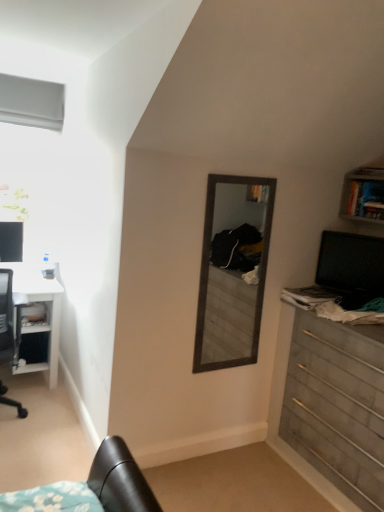
How much space does black glossy computer monitor at right, which is the second computer monitor from back to front, occupy horizontally?

The width of black glossy computer monitor at right, which is the second computer monitor from back to front, is 2.14 inches.

This screenshot has height=512, width=384. Describe the element at coordinates (337, 407) in the screenshot. I see `wooden chest of drawers at right` at that location.

What do you see at coordinates (11, 241) in the screenshot? I see `matte black monitor at left, the second computer monitor viewed from the front` at bounding box center [11, 241].

Image resolution: width=384 pixels, height=512 pixels. What do you see at coordinates (31, 102) in the screenshot?
I see `white matte window at upper left` at bounding box center [31, 102].

You are a GUI agent. You are given a task and a screenshot of the screen. Output one action in this format:
    pyautogui.click(x=<x>, y=<y>)
    Task: Click on the brushed metal shelf at lower left
    Image resolution: width=384 pixels, height=512 pixels.
    Given the screenshot: What is the action you would take?
    point(35,317)

Find the location of a particular element. black glossy computer monitor at right, the first computer monitor viewed from the front is located at coordinates (351, 267).

From a real-world perspective, is wooden chest of drawers at right below white glossy desk at left?

No, from a real-world perspective, wooden chest of drawers at right is not below white glossy desk at left.

In the scene shown: Is wooden chest of drawers at right oriented towards white glossy desk at left?

No, wooden chest of drawers at right is not turned towards white glossy desk at left.

Looking at this image, can you tell me how much wooden chest of drawers at right and white glossy desk at left differ in facing direction?

90.1 degrees.

Would you say wooden chest of drawers at right is outside white glossy desk at left?

wooden chest of drawers at right is positioned outside white glossy desk at left.

How different are the orientations of black glossy computer monitor at right, positioned as the 1th computer monitor in right-to-left order, and brushed metal shelf at lower left in degrees?

They differ by 56.6 degrees in their facing directions.

Is black glossy computer monitor at right, arranged as the 2th computer monitor when viewed from the left, oriented towards brushed metal shelf at lower left?

No, black glossy computer monitor at right, arranged as the 2th computer monitor when viewed from the left, does not turn towards brushed metal shelf at lower left.

Which is further, (334, 279) or (25, 329)?

The point (25, 329) is farther from the camera.

Is black glossy computer monitor at right, which is the second computer monitor from back to front, thinner than brushed metal shelf at lower left?

Correct, the width of black glossy computer monitor at right, which is the second computer monitor from back to front, is less than that of brushed metal shelf at lower left.

From the image's perspective, between wooden chest of drawers at right and black glossy computer monitor at right, positioned as the 1th computer monitor in right-to-left order, which one is located above?

black glossy computer monitor at right, positioned as the 1th computer monitor in right-to-left order, appears higher in the image.

Is wooden chest of drawers at right turned away from black glossy computer monitor at right, positioned as the 1th computer monitor in right-to-left order?

wooden chest of drawers at right is not turned away from black glossy computer monitor at right, positioned as the 1th computer monitor in right-to-left order.

From a real-world perspective, between wooden chest of drawers at right and black glossy computer monitor at right, which is the second computer monitor from back to front, who is vertically lower?

In real-world perspective, wooden chest of drawers at right is lower.

Based on the photo, which is less distant, (373,430) or (338,245)?

Point (373,430).

From a real-world perspective, which is physically above, wooden chest of drawers at right or matte black monitor at left, the 1th computer monitor positioned from the back?

matte black monitor at left, the 1th computer monitor positioned from the back.

Looking at this image, would you say wooden chest of drawers at right contains matte black monitor at left, the second computer monitor when ordered from right to left?

No, matte black monitor at left, the second computer monitor when ordered from right to left, is not inside wooden chest of drawers at right.

Measure the distance between wooden chest of drawers at right and matte black monitor at left, acting as the first computer monitor starting from the left.

7.37 feet.

Could you tell me if wooden chest of drawers at right is turned towards matte black monitor at left, the 1th computer monitor positioned from the back?

No, wooden chest of drawers at right is not aimed at matte black monitor at left, the 1th computer monitor positioned from the back.

Consider the image. Is white glossy desk at left positioned beyond the bounds of brushed metal shelf at lower left?

white glossy desk at left is positioned outside brushed metal shelf at lower left.

Looking at this image, is white glossy desk at left turned away from brushed metal shelf at lower left?

Correct, white glossy desk at left is looking away from brushed metal shelf at lower left.

Does point (40, 366) come closer to viewer compared to point (40, 321)?

No.

How much distance is there between white glossy desk at left and brushed metal shelf at lower left?

The distance of white glossy desk at left from brushed metal shelf at lower left is 5.49 inches.

Which object is closer to the camera taking this photo, brushed metal shelf at lower left or matte black monitor at left, acting as the first computer monitor starting from the left?

brushed metal shelf at lower left is closer to the camera.

From the image's perspective, is brushed metal shelf at lower left located beneath matte black monitor at left, the second computer monitor viewed from the front?

Yes, from the image's perspective, brushed metal shelf at lower left is beneath matte black monitor at left, the second computer monitor viewed from the front.

Consider the image. Which is nearer, (x=31, y=309) or (x=22, y=228)?

Point (x=31, y=309).

Can you confirm if wooden chest of drawers at right is smaller than brushed metal shelf at lower left?

Actually, wooden chest of drawers at right might be larger than brushed metal shelf at lower left.

Which object is closer to the camera taking this photo, wooden chest of drawers at right or brushed metal shelf at lower left?

wooden chest of drawers at right.

From the image's perspective, who appears lower, wooden chest of drawers at right or brushed metal shelf at lower left?

wooden chest of drawers at right.

Image resolution: width=384 pixels, height=512 pixels. There is a white glossy desk at left. Identify the location of the chest of drawers above it (from a real-world perspective). (337, 407).

The height and width of the screenshot is (512, 384). Find the location of `computer monitor on the right of brushed metal shelf at lower left`. computer monitor on the right of brushed metal shelf at lower left is located at coordinates (351, 267).

Estimate the real-world distances between objects in this image. Which object is further from white glossy desk at left, matte black monitor at left, the second computer monitor viewed from the front, or white matte window at upper left?

white matte window at upper left is positioned further to the anchor white glossy desk at left.

Based on their spatial positions, is brushed metal shelf at lower left or matte black monitor at left, the 1th computer monitor positioned from the back, closer to white glossy desk at left?

The object closer to white glossy desk at left is brushed metal shelf at lower left.

Estimate the real-world distances between objects in this image. Which object is closer to wooden chest of drawers at right, matte black monitor at left, acting as the first computer monitor starting from the left, or white matte window at upper left?

matte black monitor at left, acting as the first computer monitor starting from the left, is closer to wooden chest of drawers at right.

From the image, which object appears to be nearer to matte black monitor at left, the second computer monitor viewed from the front, wooden chest of drawers at right or black glossy computer monitor at right, positioned as the 1th computer monitor in right-to-left order?

black glossy computer monitor at right, positioned as the 1th computer monitor in right-to-left order, is closer to matte black monitor at left, the second computer monitor viewed from the front.

Consider the image. Estimate the real-world distances between objects in this image. Which object is closer to white glossy desk at left, black glossy computer monitor at right, arranged as the 2th computer monitor when viewed from the left, or matte black monitor at left, the 1th computer monitor positioned from the back?

matte black monitor at left, the 1th computer monitor positioned from the back.

Estimate the real-world distances between objects in this image. Which object is closer to matte black monitor at left, acting as the first computer monitor starting from the left, brushed metal shelf at lower left or wooden chest of drawers at right?

Based on the image, brushed metal shelf at lower left appears to be nearer to matte black monitor at left, acting as the first computer monitor starting from the left.

Considering their positions, is brushed metal shelf at lower left positioned further to wooden chest of drawers at right than white glossy desk at left?

brushed metal shelf at lower left is further to wooden chest of drawers at right.

Considering their positions, is white glossy desk at left positioned further to white matte window at upper left than black glossy computer monitor at right, arranged as the 2th computer monitor when viewed from the left?

black glossy computer monitor at right, arranged as the 2th computer monitor when viewed from the left.

Find the location of a particular element. The height and width of the screenshot is (512, 384). chest of drawers between white matte window at upper left and black glossy computer monitor at right, the first computer monitor viewed from the front, in the horizontal direction is located at coordinates (337, 407).

Where is `chest of drawers between white glossy desk at left and black glossy computer monitor at right, the first computer monitor viewed from the front`? chest of drawers between white glossy desk at left and black glossy computer monitor at right, the first computer monitor viewed from the front is located at coordinates (337, 407).

Find the location of `desk between matte black monitor at left, the second computer monitor viewed from the front, and wooden chest of drawers at right from left to right`. desk between matte black monitor at left, the second computer monitor viewed from the front, and wooden chest of drawers at right from left to right is located at coordinates (47, 314).

In order to click on chest of drawers between matte black monitor at left, the second computer monitor viewed from the front, and black glossy computer monitor at right, which is the second computer monitor from back to front, in the horizontal direction in this screenshot , I will do `click(337, 407)`.